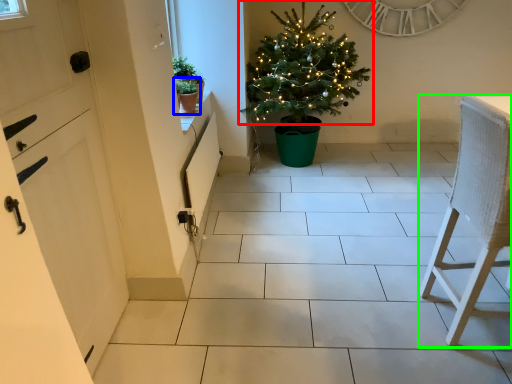
Question: Based on their relative distances, which object is nearer to christmas tree (highlighted by a red box)? Choose from houseplant (highlighted by a blue box) and furniture (highlighted by a green box).

Choices:
 (A) houseplant
 (B) furniture

Answer: (A)